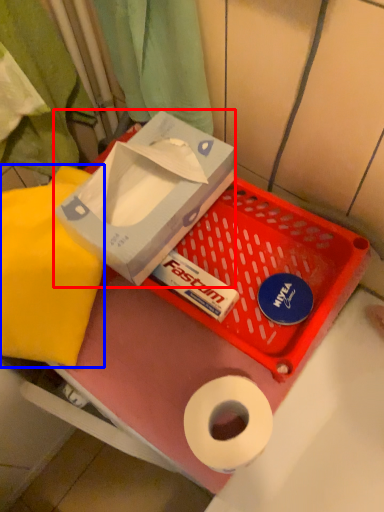
Question: Which object is further to the camera taking this photo, box (highlighted by a red box) or cloth (highlighted by a blue box)?

Choices:
 (A) box
 (B) cloth

Answer: (B)